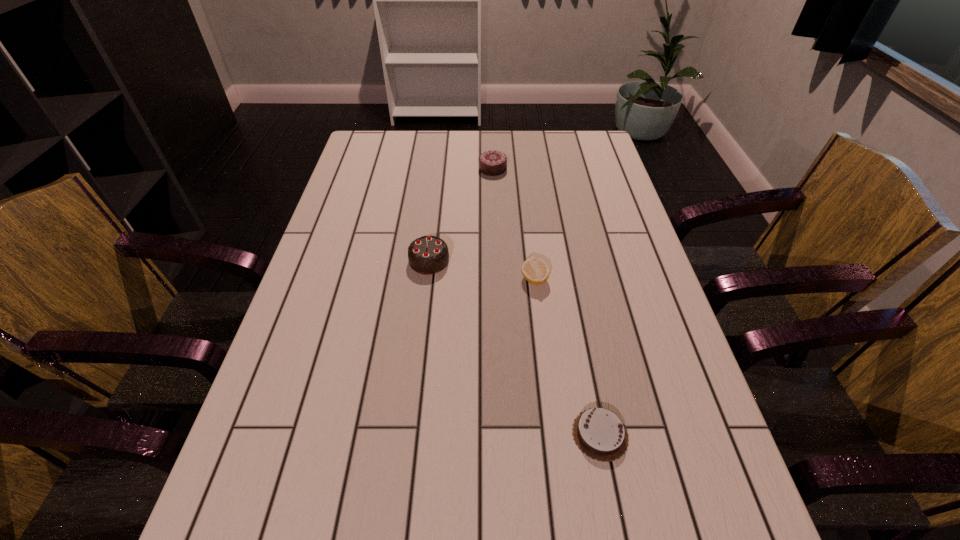
Identify which chocolate cake is the second nearest to the third object from left to right. Please provide its 2D coordinates. Your answer should be formatted as a tuple, i.e. [(x, y)], where the tuple contains the x and y coordinates of a point satisfying the conditions above.

[(599, 433)]

Find the location of `free location that satisfies the following two spatial constraints: 1. on the front side of the rightmost chocolate cake; 2. on the left side of the leftmost object`. free location that satisfies the following two spatial constraints: 1. on the front side of the rightmost chocolate cake; 2. on the left side of the leftmost object is located at coordinates (409, 435).

The width and height of the screenshot is (960, 540). I want to click on vacant space that satisfies the following two spatial constraints: 1. on the back side of the leftmost object; 2. on the left side of the second shortest chocolate cake, so click(440, 168).

Find the location of a particular element. The width and height of the screenshot is (960, 540). vacant space that satisfies the following two spatial constraints: 1. on the front side of the lemon; 2. on the left side of the second object from left to right is located at coordinates (496, 279).

I want to click on vacant space that satisfies the following two spatial constraints: 1. on the front side of the rightmost object; 2. on the left side of the third tallest object, so click(x=553, y=435).